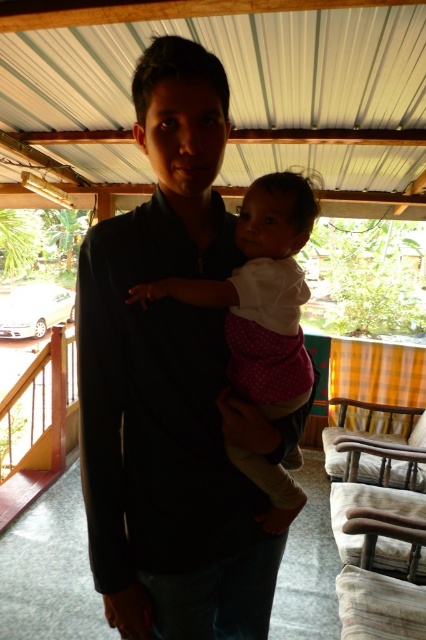
Question: Can you confirm if dark blue shirt at center is wider than white polka dot fabric at center?

Choices:
 (A) yes
 (B) no

Answer: (A)

Question: Does dark blue shirt at center appear over white polka dot fabric at center?

Choices:
 (A) no
 (B) yes

Answer: (A)

Question: Which object appears closest to the camera in this image?

Choices:
 (A) white polka dot fabric at center
 (B) dark blue shirt at center

Answer: (B)

Question: Which point is closer to the camera?

Choices:
 (A) dark blue shirt at center
 (B) white polka dot fabric at center

Answer: (A)

Question: Is dark blue shirt at center below white polka dot fabric at center?

Choices:
 (A) yes
 (B) no

Answer: (A)